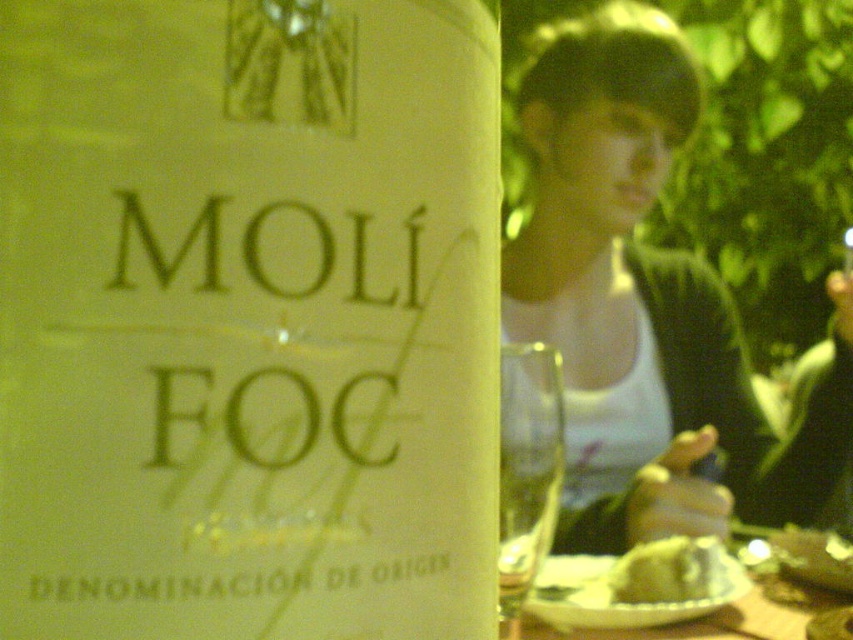
Question: Does transparent glass wine glass at center appear over smooth yellow cake at lower right?

Choices:
 (A) no
 (B) yes

Answer: (B)

Question: Can you confirm if white paper bottle at center is thinner than white cotton tank top at upper center?

Choices:
 (A) no
 (B) yes

Answer: (B)

Question: Estimate the real-world distances between objects in this image. Which object is farther from the transparent glass wine glass at center?

Choices:
 (A) white cotton tank top at upper center
 (B) smooth yellow cake at lower right

Answer: (A)

Question: Which object is farther from the camera taking this photo?

Choices:
 (A) smooth yellow cake at lower right
 (B) transparent glass wine glass at center

Answer: (A)

Question: Considering the real-world distances, which object is closest to the smooth yellow cake at lower right?

Choices:
 (A) transparent glass wine glass at center
 (B) white paper bottle at center
 (C) white cotton tank top at upper center

Answer: (A)

Question: Is white paper bottle at center further to camera compared to transparent glass wine glass at center?

Choices:
 (A) yes
 (B) no

Answer: (B)